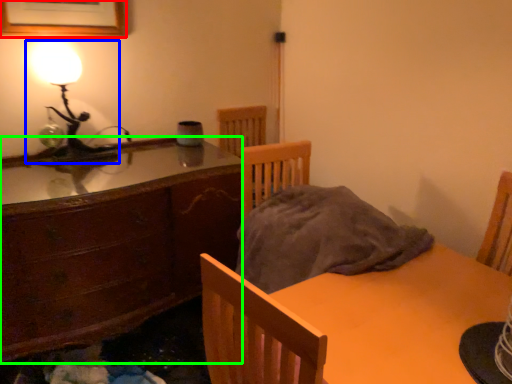
Question: Considering the real-world distances, which object is closest to picture frame (highlighted by a red box)? lamp (highlighted by a blue box) or cabinetry (highlighted by a green box).

Choices:
 (A) lamp
 (B) cabinetry

Answer: (A)